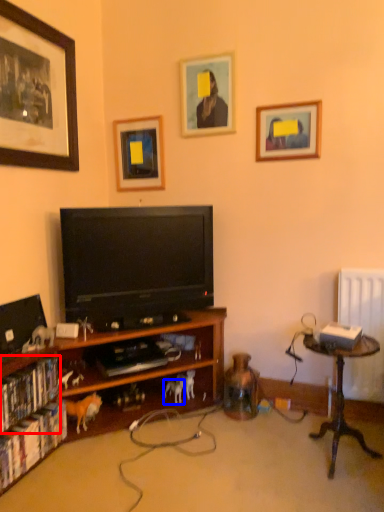
Question: Which of the following is the farthest to the observer, book (highlighted by a red box) or animal (highlighted by a blue box)?

Choices:
 (A) book
 (B) animal

Answer: (B)